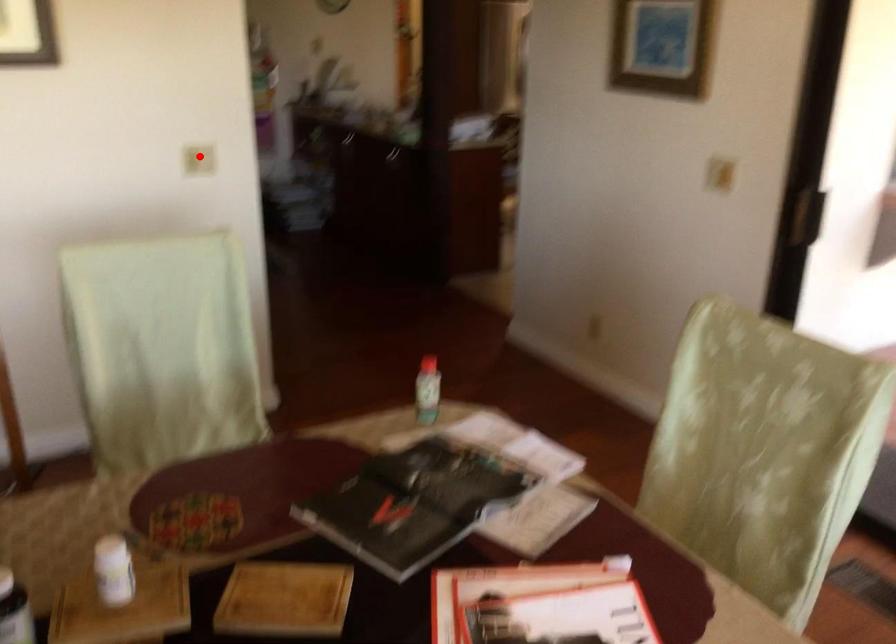
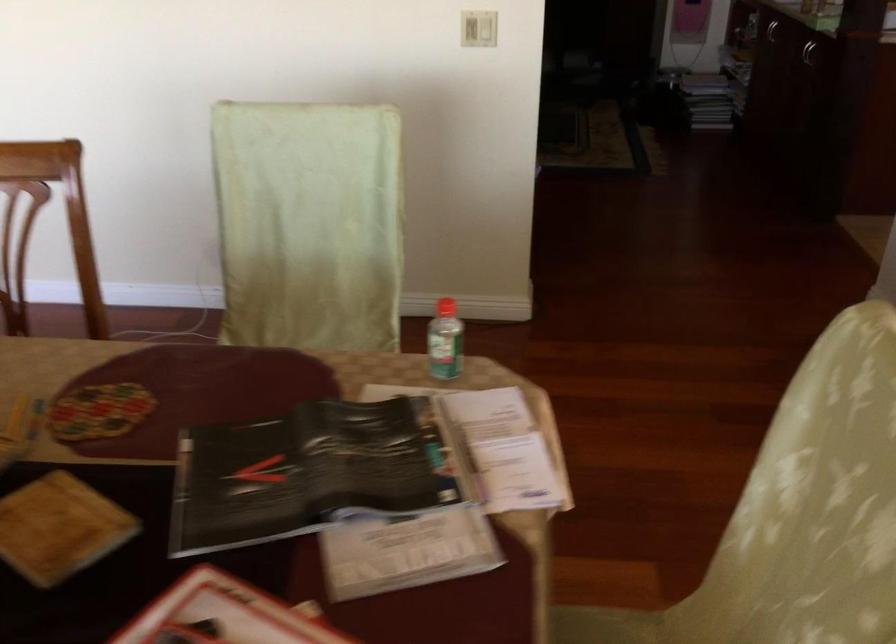
Where in the second image is the point corresponding to the highlighted location from the first image?

(478, 29)